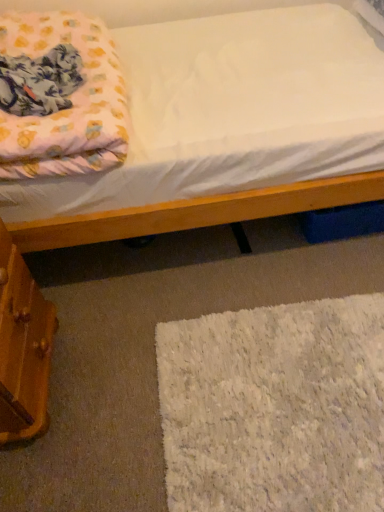
Measure the distance between point (14, 257) and camera.

Point (14, 257) and camera are 3.47 feet apart.

What is the approximate width of fluffy pink blanket at upper left?

It is 18.28 inches.

Locate an element on the screen. The width and height of the screenshot is (384, 512). wooden drawer at lower left is located at coordinates (23, 352).

Is white fluffy rug at lower right in contact with fluffy pink blanket at upper left?

There is a gap between white fluffy rug at lower right and fluffy pink blanket at upper left.

Considering their positions, is white fluffy rug at lower right located in front of or behind fluffy pink blanket at upper left?

Visually, white fluffy rug at lower right is located behind fluffy pink blanket at upper left.

From a real-world perspective, is white fluffy rug at lower right physically below fluffy pink blanket at upper left?

Yes, from a real-world perspective, white fluffy rug at lower right is under fluffy pink blanket at upper left.

Which is behind, point (359, 486) or point (100, 63)?

The point (100, 63) is behind.

Is wooden drawer at lower left facing away from white fluffy rug at lower right?

No, wooden drawer at lower left's orientation is not away from white fluffy rug at lower right.

Is wooden drawer at lower left to the right of white fluffy rug at lower right from the viewer's perspective?

No.

Considering the relative sizes of wooden drawer at lower left and white fluffy rug at lower right in the image provided, is wooden drawer at lower left bigger than white fluffy rug at lower right?

Yes.

From the picture: Is the depth of wooden drawer at lower left greater than that of white fluffy rug at lower right?

No, the depth of wooden drawer at lower left is less than that of white fluffy rug at lower right.

Is fluffy pink blanket at upper left not within wooden drawer at lower left?

Yes, fluffy pink blanket at upper left is located beyond the bounds of wooden drawer at lower left.

From a real-world perspective, is fluffy pink blanket at upper left under wooden drawer at lower left?

No, from a real-world perspective, fluffy pink blanket at upper left is not under wooden drawer at lower left.

Is fluffy pink blanket at upper left taller than wooden drawer at lower left?

Incorrect, the height of fluffy pink blanket at upper left is not larger of that of wooden drawer at lower left.

Measure the distance between fluffy pink blanket at upper left and wooden drawer at lower left.

18.81 inches.

Is point (48, 371) more distant than point (32, 163)?

Yes, point (48, 371) is farther from viewer.

Is wooden drawer at lower left positioned with its back to fluffy pink blanket at upper left?

No.

Is wooden drawer at lower left positioned beyond the bounds of fluffy pink blanket at upper left?

Yes, wooden drawer at lower left is outside of fluffy pink blanket at upper left.

From the image's perspective, which object appears higher, wooden drawer at lower left or fluffy pink blanket at upper left?

fluffy pink blanket at upper left is shown above in the image.

Is white fluffy rug at lower right positioned beyond the bounds of wooden drawer at lower left?

Yes, white fluffy rug at lower right is outside of wooden drawer at lower left.

From a real-world perspective, which object rests below the other?

From a 3D spatial view, white fluffy rug at lower right is below.

Is white fluffy rug at lower right closer to the viewer compared to wooden drawer at lower left?

That is False.

Considering the relative positions of white fluffy rug at lower right and wooden drawer at lower left in the image provided, is white fluffy rug at lower right to the left of wooden drawer at lower left from the viewer's perspective?

No.

Could you tell me if fluffy pink blanket at upper left is facing white fluffy rug at lower right?

No, fluffy pink blanket at upper left is not aimed at white fluffy rug at lower right.

Measure the distance between fluffy pink blanket at upper left and white fluffy rug at lower right.

fluffy pink blanket at upper left and white fluffy rug at lower right are 31.37 inches apart.

Is point (106, 51) closer to camera compared to point (305, 366)?

No.

Are fluffy pink blanket at upper left and white fluffy rug at lower right far apart?

Actually, fluffy pink blanket at upper left and white fluffy rug at lower right are a little close together.

There is a white fluffy rug at lower right. Identify the location of blanket above it (from a real-world perspective). (59, 96).

The width and height of the screenshot is (384, 512). I want to click on mat lying below the wooden drawer at lower left (from the image's perspective), so click(275, 407).

Which object lies further to the anchor point fluffy pink blanket at upper left, white fluffy rug at lower right or wooden drawer at lower left?

Based on the image, white fluffy rug at lower right appears to be further to fluffy pink blanket at upper left.

From the image, which object appears to be nearer to wooden drawer at lower left, fluffy pink blanket at upper left or white fluffy rug at lower right?

Among the two, fluffy pink blanket at upper left is located nearer to wooden drawer at lower left.

Estimate the real-world distances between objects in this image. Which object is closer to fluffy pink blanket at upper left, wooden drawer at lower left or white fluffy rug at lower right?

The object closer to fluffy pink blanket at upper left is wooden drawer at lower left.

Looking at the image, which one is located further to white fluffy rug at lower right, fluffy pink blanket at upper left or wooden drawer at lower left?

Among the two, fluffy pink blanket at upper left is located further to white fluffy rug at lower right.

Considering their positions, is white fluffy rug at lower right positioned closer to wooden drawer at lower left than fluffy pink blanket at upper left?

Among the two, fluffy pink blanket at upper left is located nearer to wooden drawer at lower left.

Considering their positions, is wooden drawer at lower left positioned further to white fluffy rug at lower right than fluffy pink blanket at upper left?

The object further to white fluffy rug at lower right is fluffy pink blanket at upper left.

Identify the location of drawer between fluffy pink blanket at upper left and white fluffy rug at lower right vertically. (23, 352).